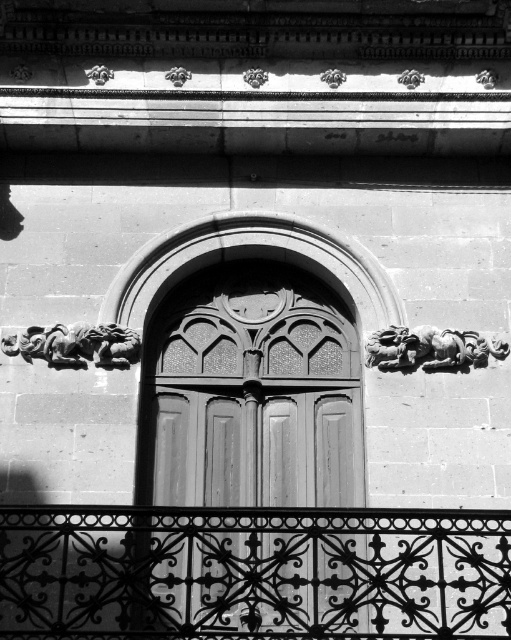
You are an architect analyzing the building facade. You need to determine which object between the black wrought iron at lower center and the polished stone sculpture at upper right is taller. Based on the scene, which one is taller?

The black wrought iron at lower center has a greater height compared to the polished stone sculpture at upper right, so the black wrought iron at lower center is taller.